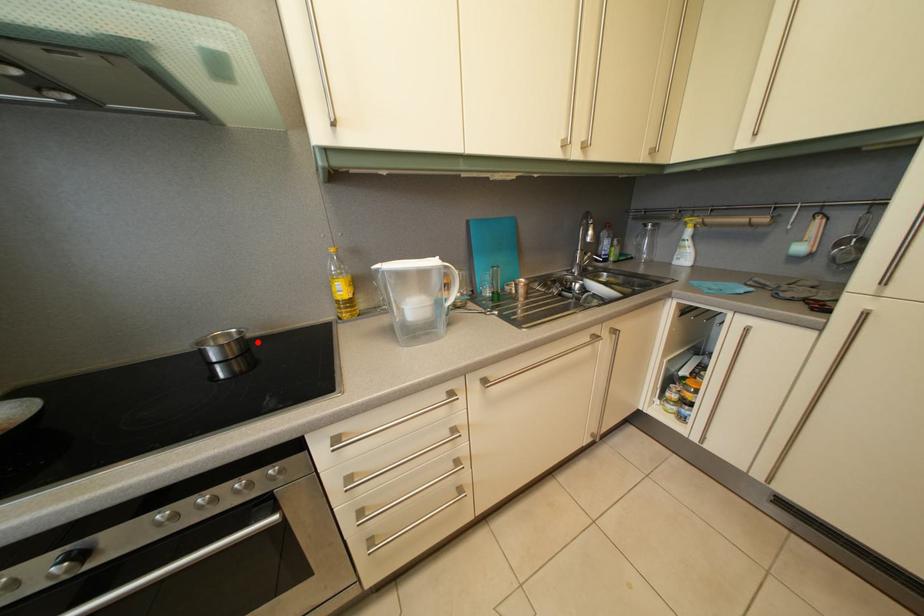
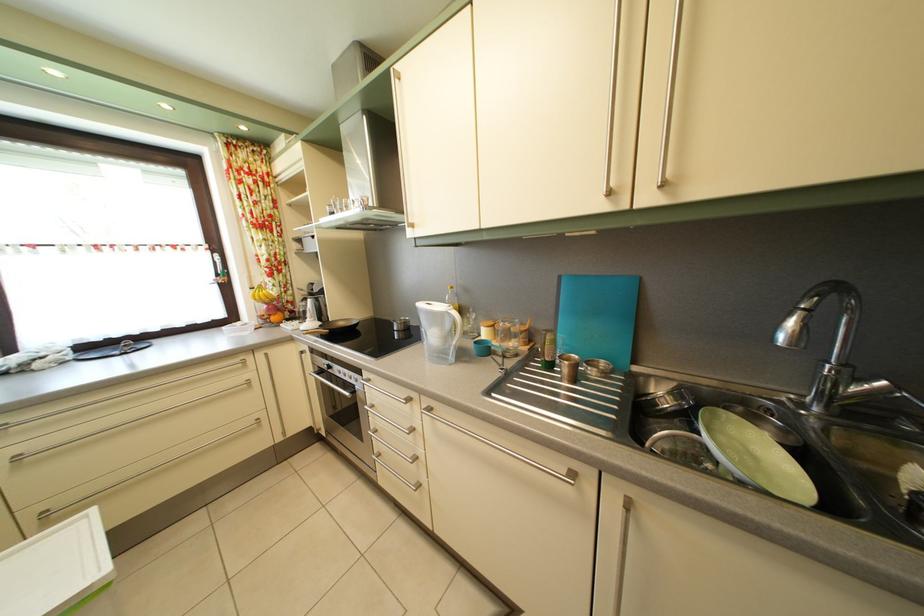
Question: I am providing you with two images of the same scene from different viewpoints. Image1 has a red point marked. In image2, the corresponding 3D location appears at what relative position? Reply with the corresponding letter.

Choices:
 (A) Closer
 (B) Farther

Answer: (B)